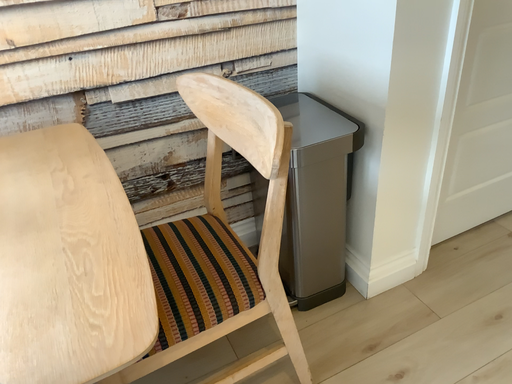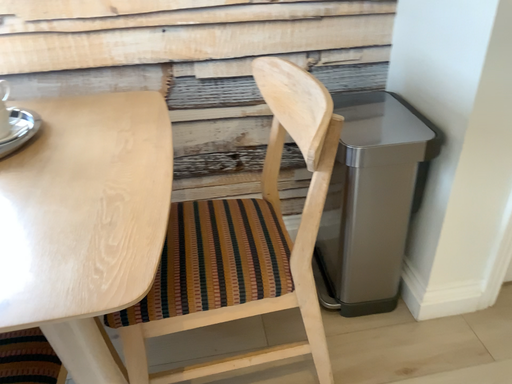
Question: Which way did the camera rotate in the video?

Choices:
 (A) rotated right
 (B) rotated left

Answer: (B)